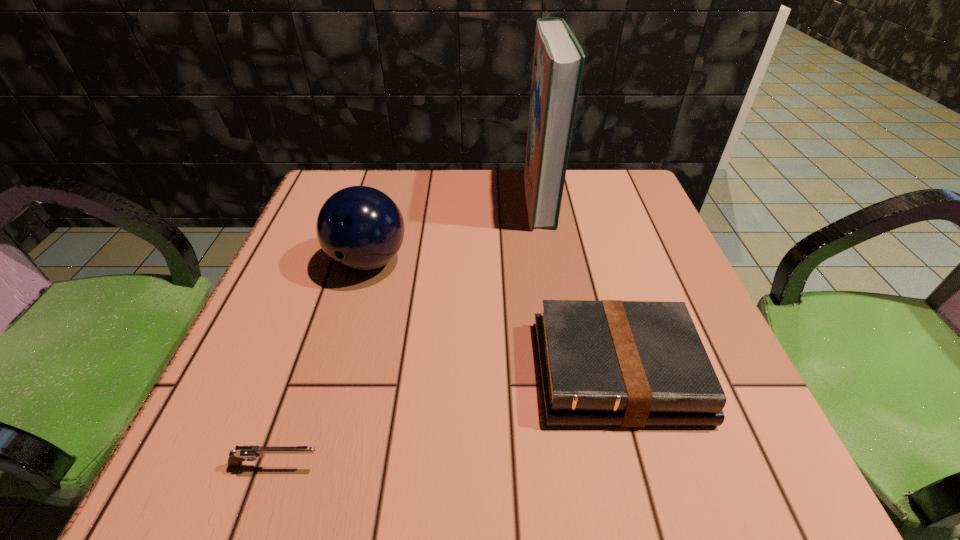
Identify the location of object that stands as the second closest to the nearest object. Image resolution: width=960 pixels, height=540 pixels. (360, 228).

Where is `blank space that satisfies the following two spatial constraints: 1. on the surface of the third nearest object near the finger holes; 2. on the front-facing side of the nearest object`? This screenshot has width=960, height=540. blank space that satisfies the following two spatial constraints: 1. on the surface of the third nearest object near the finger holes; 2. on the front-facing side of the nearest object is located at coordinates (311, 465).

I want to click on blank space that satisfies the following two spatial constraints: 1. on the cover of the taller hardback book; 2. on the surface of the third nearest object near the finger holes, so click(x=551, y=261).

Where is `vacant area in the image that satisfies the following two spatial constraints: 1. on the surface of the third shortest object near the finger holes; 2. on the front-facing side of the nearest object`? This screenshot has height=540, width=960. vacant area in the image that satisfies the following two spatial constraints: 1. on the surface of the third shortest object near the finger holes; 2. on the front-facing side of the nearest object is located at coordinates (311, 465).

The width and height of the screenshot is (960, 540). I want to click on vacant region that satisfies the following two spatial constraints: 1. on the surface of the bowling ball near the finger holes; 2. on the front-facing side of the nearest object, so click(x=311, y=465).

You are a GUI agent. You are given a task and a screenshot of the screen. Output one action in this format:
    pyautogui.click(x=<x>, y=<y>)
    Task: Click on the vacant space that satisfies the following two spatial constraints: 1. on the spine side of the second shortest object; 2. on the front-facing side of the shortest object
    
    Given the screenshot: What is the action you would take?
    pyautogui.click(x=642, y=465)